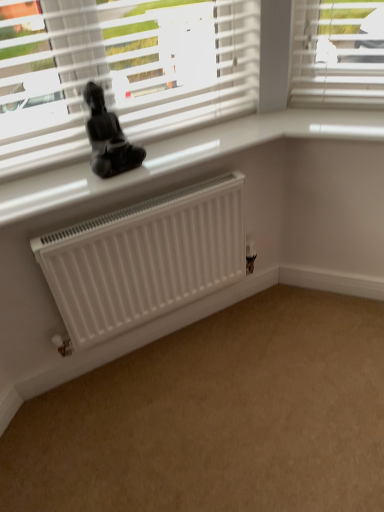
Where is `free region under white matte radiator at center (from a real-world perspective)`? The height and width of the screenshot is (512, 384). free region under white matte radiator at center (from a real-world perspective) is located at coordinates (158, 344).